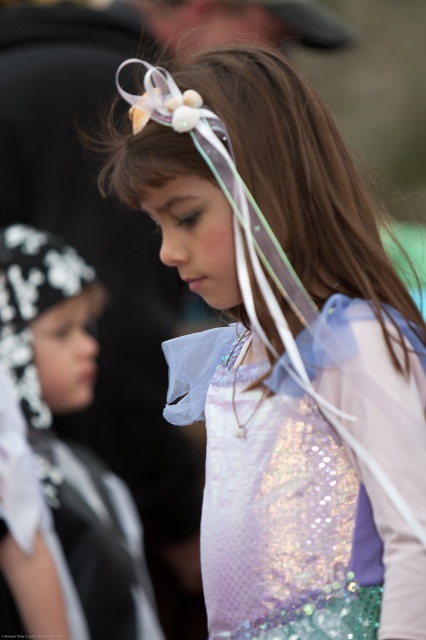
You are a costume designer assessing two costumes in the image. The holographic sequin dress at center and the white sequined cape at left. Which costume is shorter in height?

The holographic sequin dress at center is shorter in height compared to the white sequined cape at left.

You are a photographer setting up for a photoshoot with two children in costumes. You need to position a backdrop that is 2 meters wide. The children are wearing the holographic sequin dress at center and the white sequined cape at left. Based on their costumes, will the backdrop be wide enough to fit both of them comfortably?

The holographic sequin dress at center might be wider than white sequined cape at left, so the total width of both costumes could exceed 2 meters. The backdrop may not be wide enough for both comfortably.

You are a photographer setting up for a photoshoot and need to position a spotlight at point 0.8, 0.6 to highlight the holographic sequin dress at center. Is the spotlight placed correctly?

The holographic sequin dress at center is located at point (287,508), so the spotlight at (255,512) is very close but slightly offset. To ensure proper illumination, the spotlight should be adjusted to align more precisely with the dress.